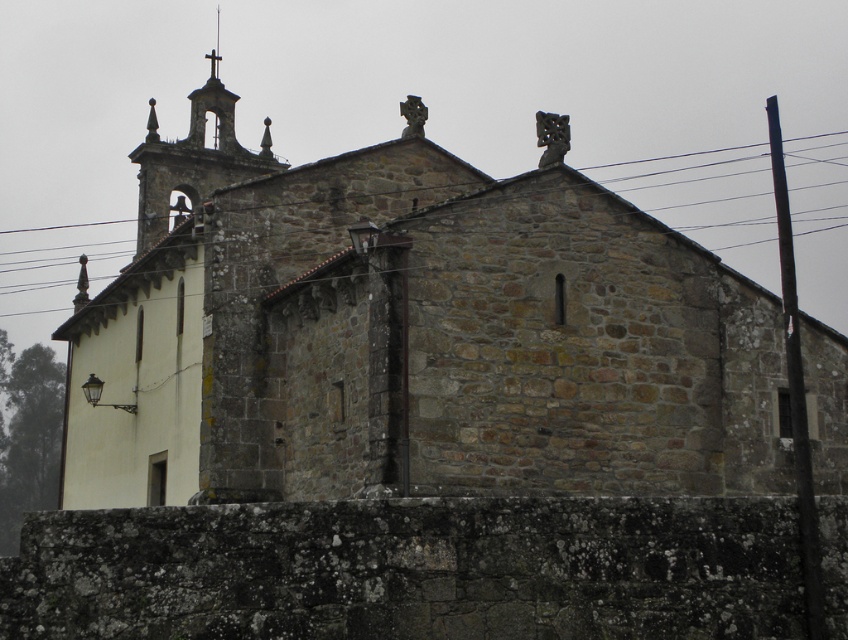
Question: Which point is closer to the camera?

Choices:
 (A) tap(54, 248)
 (B) tap(444, 416)

Answer: (B)

Question: Which point is closer to the camera?

Choices:
 (A) black wire at upper center
 (B) stone church at center

Answer: (B)

Question: Considering the relative positions of stone church at center and black wire at upper center in the image provided, where is stone church at center located with respect to black wire at upper center?

Choices:
 (A) above
 (B) below

Answer: (B)

Question: Does stone church at center come behind black wire at upper center?

Choices:
 (A) yes
 (B) no

Answer: (B)

Question: Can you confirm if stone church at center is positioned above black wire at upper center?

Choices:
 (A) yes
 (B) no

Answer: (B)

Question: Which point is farther from the camera taking this photo?

Choices:
 (A) (734, 160)
 (B) (110, 364)

Answer: (A)